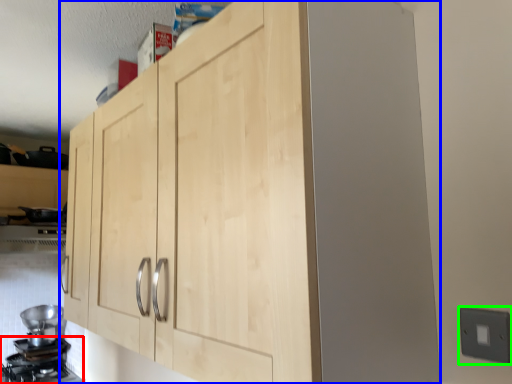
Question: Considering the real-world distances, which object is farthest from gas stove (highlighted by a red box)? cupboard (highlighted by a blue box) or electric outlet (highlighted by a green box)?

Choices:
 (A) cupboard
 (B) electric outlet

Answer: (B)